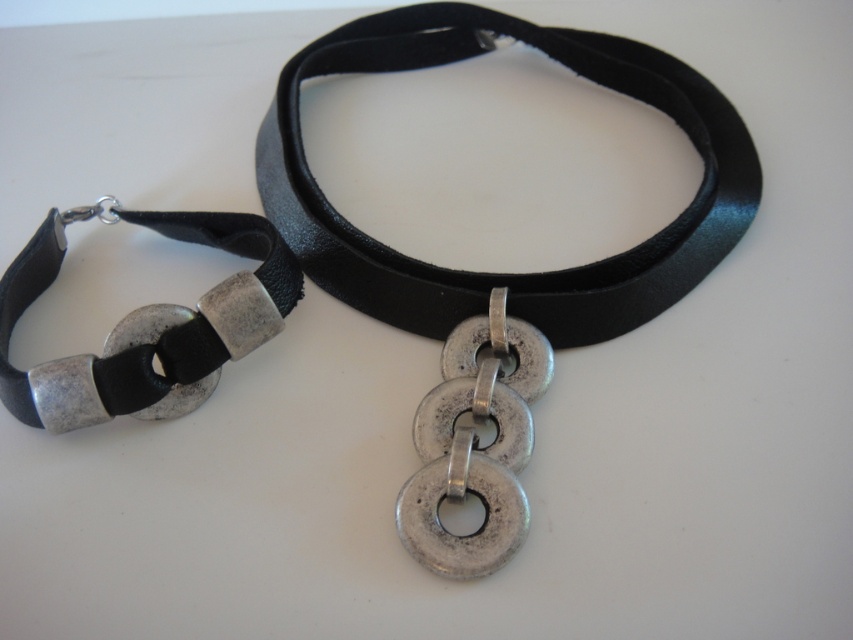
Based on the photo, does black leather strap at left appear over silver metallic chain at center?

Yes, black leather strap at left is above silver metallic chain at center.

Who is more forward, (67, 412) or (466, 460)?

Point (466, 460) is more forward.

Is point (218, 342) in front of point (500, 397)?

No, (218, 342) is behind (500, 397).

You are a GUI agent. You are given a task and a screenshot of the screen. Output one action in this format:
    pyautogui.click(x=<x>, y=<y>)
    Task: Click on the black leather strap at left
    The height and width of the screenshot is (640, 853).
    Given the screenshot: What is the action you would take?
    point(148,323)

Does black leather choker at center appear on the right side of silver metallic chain at center?

Indeed, black leather choker at center is positioned on the right side of silver metallic chain at center.

Is black leather choker at center further to the viewer compared to silver metallic chain at center?

Yes.

Is point (660, 83) more distant than point (490, 332)?

Yes, it is.

You are a GUI agent. You are given a task and a screenshot of the screen. Output one action in this format:
    pyautogui.click(x=<x>, y=<y>)
    Task: Click on the black leather choker at center
    The height and width of the screenshot is (640, 853).
    Given the screenshot: What is the action you would take?
    coord(508,273)

Is black leather choker at center positioned at the back of black leather strap at left?

Yes, it is behind black leather strap at left.

This screenshot has width=853, height=640. What do you see at coordinates (508, 273) in the screenshot?
I see `black leather choker at center` at bounding box center [508, 273].

Does point (321, 214) lie behind point (201, 340)?

That is True.

This screenshot has height=640, width=853. I want to click on black leather choker at center, so click(508, 273).